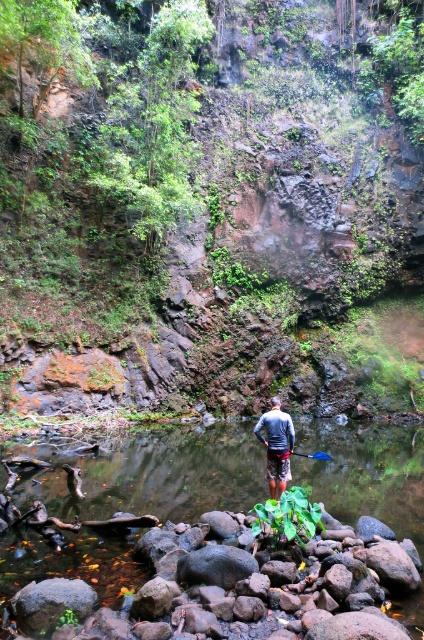
Looking at this image, does smooth rock stream at center have a larger size compared to gray fabric shirt at center?

Indeed, smooth rock stream at center has a larger size compared to gray fabric shirt at center.

Consider the image. Which is above, smooth rock stream at center or gray fabric shirt at center?

gray fabric shirt at center is above.

This screenshot has height=640, width=424. What do you see at coordinates (158, 476) in the screenshot? I see `smooth rock stream at center` at bounding box center [158, 476].

This screenshot has width=424, height=640. Identify the location of smooth rock stream at center. (158, 476).